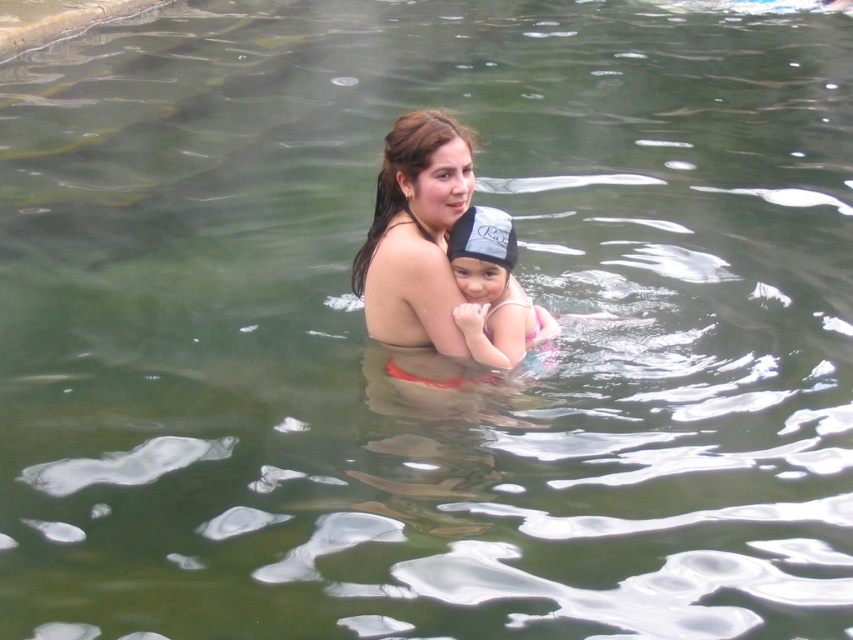
Based on the scene, which object at the center has a bigger size between the dark brown hair at center and the pink fabric swimsuit at center?

The dark brown hair at center has a larger size compared to the pink fabric swimsuit at center.

You are a lifeguard observing the scene. You notice two objects at the center of the pool area. Which object is positioned higher in the water between the dark brown hair at center and the pink fabric swimsuit at center?

The dark brown hair at center is above the pink fabric swimsuit at center, so it is positioned higher in the water.

In the scene shown: Looking at the scene, where is the dark brown hair at center in relation to the pink fabric swimsuit at center?

The dark brown hair at center is to the left of the pink fabric swimsuit at center.